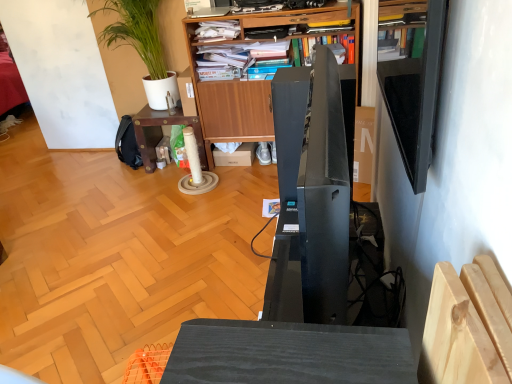
Question: From the image's perspective, is black glossy shelf at upper right positioned above or below green leafy plant at upper left?

Choices:
 (A) below
 (B) above

Answer: (A)

Question: From a real-world perspective, is black glossy shelf at upper right positioned above or below green leafy plant at upper left?

Choices:
 (A) below
 (B) above

Answer: (B)

Question: Based on their relative distances, which object is nearer to the black glossy shelf at upper right?

Choices:
 (A) wooden table at center
 (B) green leafy plant at upper left
 (C) black glossy speaker at center
 (D) wooden bookcase at upper center

Answer: (C)

Question: Estimate the real-world distances between objects in this image. Which object is farther from the green leafy plant at upper left?

Choices:
 (A) black glossy shelf at upper right
 (B) wooden bookcase at upper center
 (C) black glossy speaker at center
 (D) wooden table at center

Answer: (A)